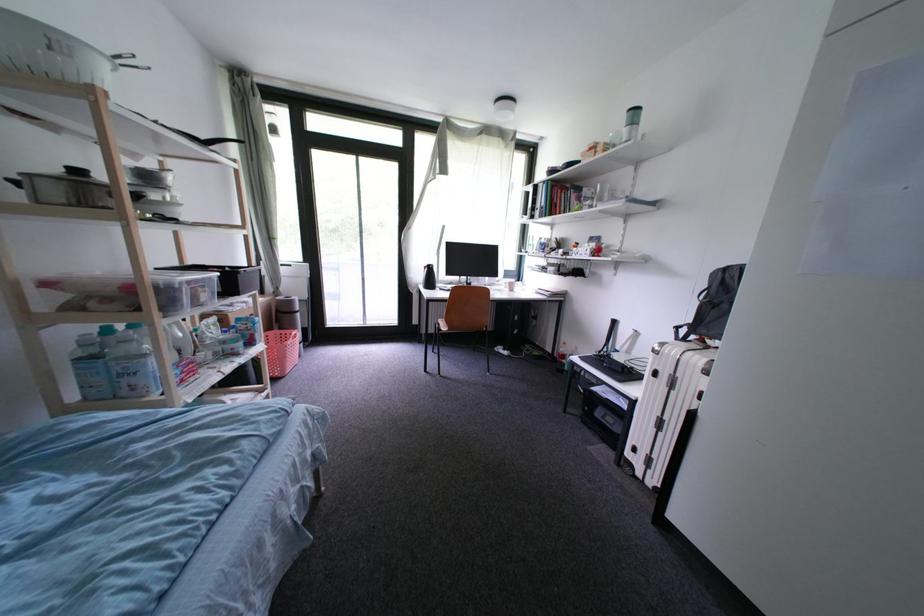
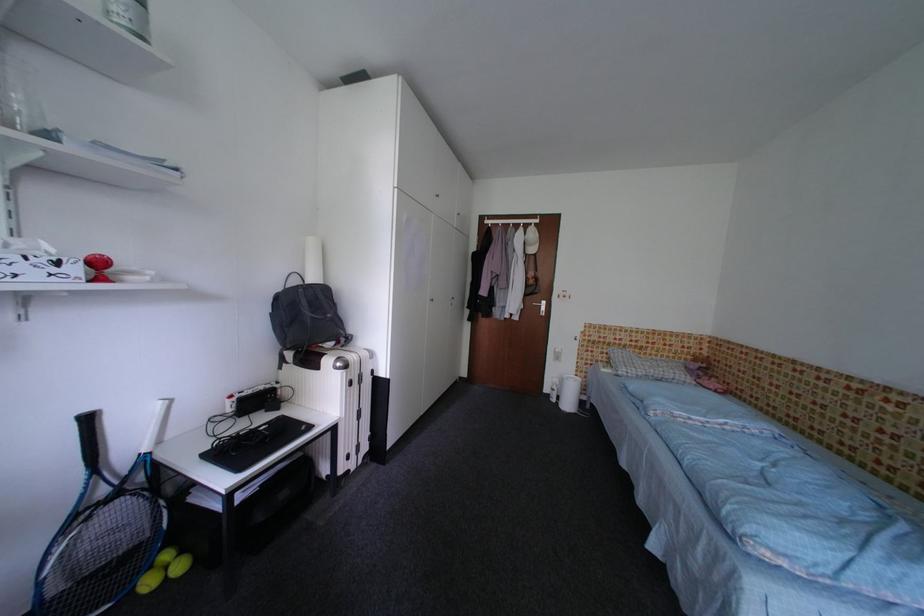
Where in the second image is the point corresponding to (x=597, y=254) from the first image?

(83, 272)